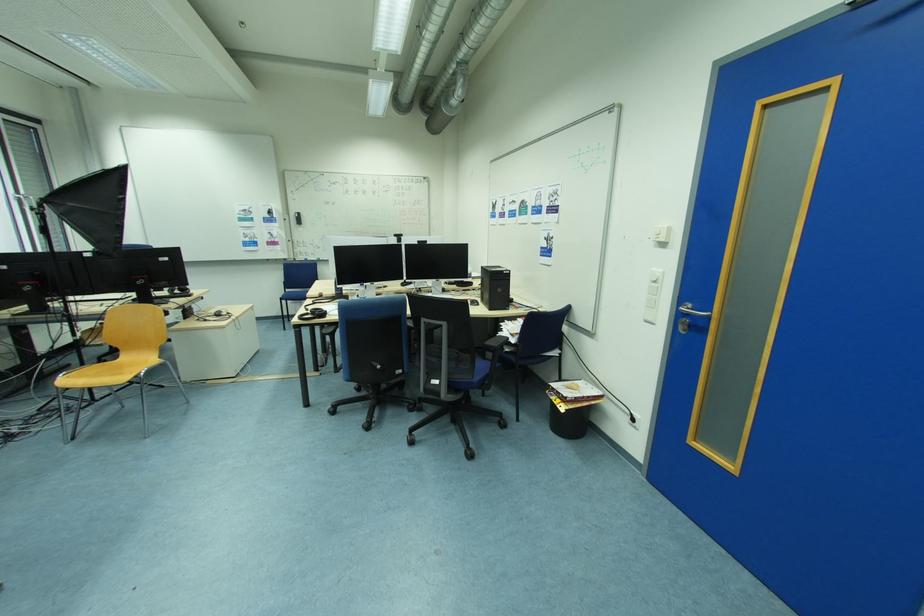
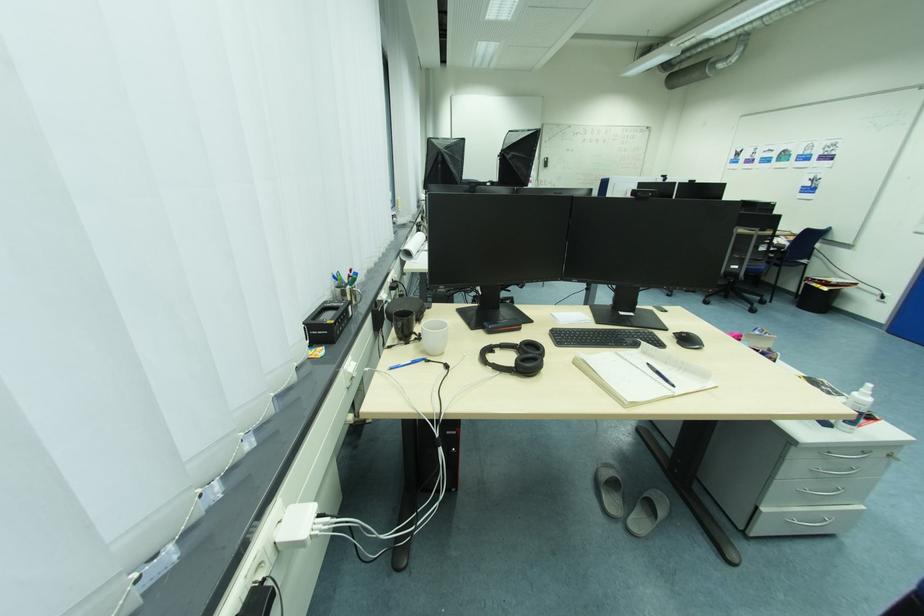
Question: I am providing you with two images of the same scene from different viewpoints. Which of the following objects are not visible in image2?

Choices:
 (A) black headphones
 (B) chair sitting surface
 (C) potted orchid plant
 (D) black trash bin

Answer: (B)